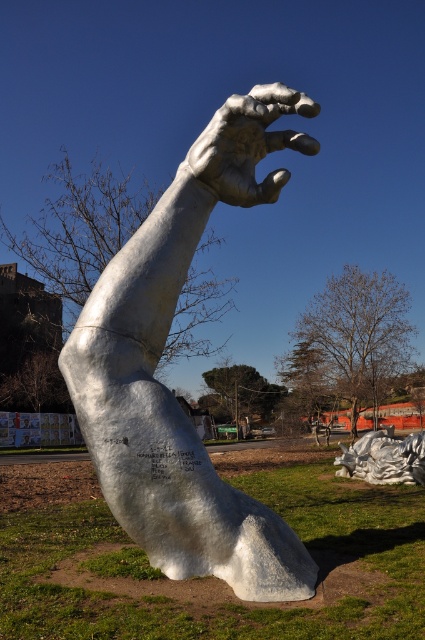
You are an art student analyzing the sculpture installation. You notice the white marble hand at center and the shiny silver sculpture at lower right. Which object would appear larger when viewed from the front?

The shiny silver sculpture at lower right appears larger because it is bigger than the white marble hand at center.

You are standing in front of the sculpture of a metallic arm and hand reaching upwards. There is a point at coordinates point (x=156, y=212) that you need to reach. Considering your height is 5 feet 6 inches, can you touch this point without any assistance?

The point (x=156, y=212) is 16.36 feet away from the viewer. Since your height is 5 feet 6 inches, you cannot reach this point without assistance as it is much higher than your height.